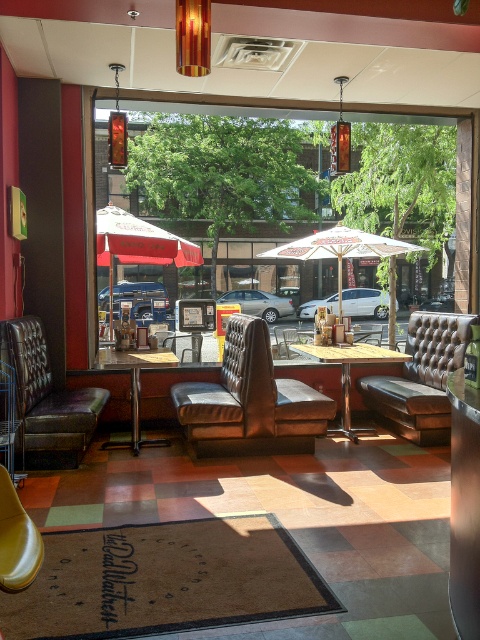
Between brown leather armchair at center and white fabric umbrella at center, which one is positioned lower?

brown leather armchair at center is below.

Does point (280, 412) lie behind point (280, 244)?

No.

I want to click on brown leather armchair at center, so click(x=250, y=401).

Based on the photo, between brown leather armchair at center and yellow leather armchair at lower left, which one appears on the left side from the viewer's perspective?

yellow leather armchair at lower left is more to the left.

Is point (240, 451) positioned before point (1, 582)?

No, (240, 451) is behind (1, 582).

The image size is (480, 640). I want to click on brown leather armchair at center, so click(250, 401).

How distant is brown leather armchair at center from red fabric umbrella at center?

They are 2.06 meters apart.

Can you confirm if brown leather armchair at center is positioned below red fabric umbrella at center?

Yes, brown leather armchair at center is below red fabric umbrella at center.

I want to click on brown leather armchair at center, so click(250, 401).